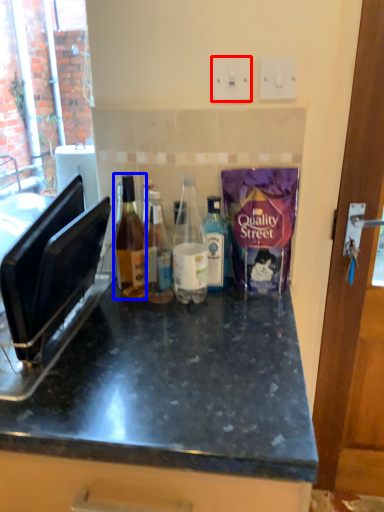
Question: Among these objects, which one is nearest to the camera, electric outlet (highlighted by a red box) or bottle (highlighted by a blue box)?

Choices:
 (A) electric outlet
 (B) bottle

Answer: (B)